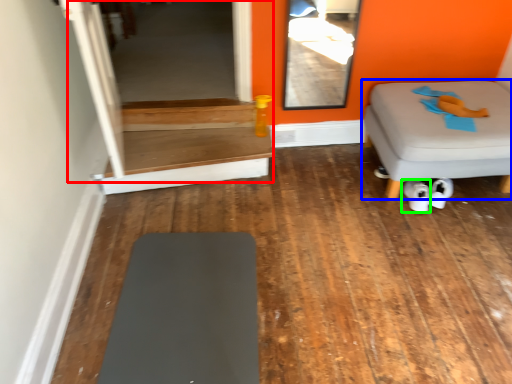
Question: Estimate the real-world distances between objects in this image. Which object is farther from glass door (highlighted by a red box), furniture (highlighted by a blue box) or footwear (highlighted by a green box)?

Choices:
 (A) furniture
 (B) footwear

Answer: (B)